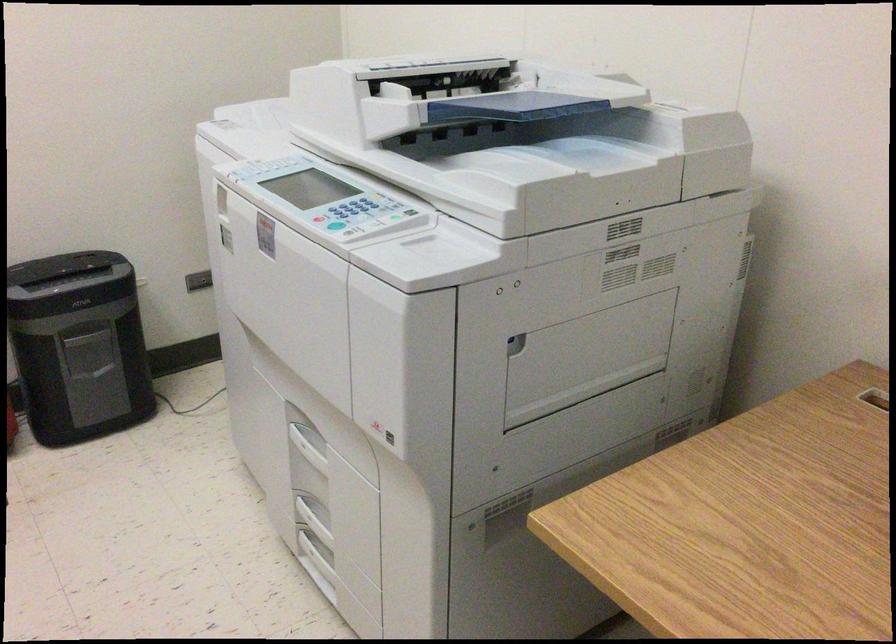
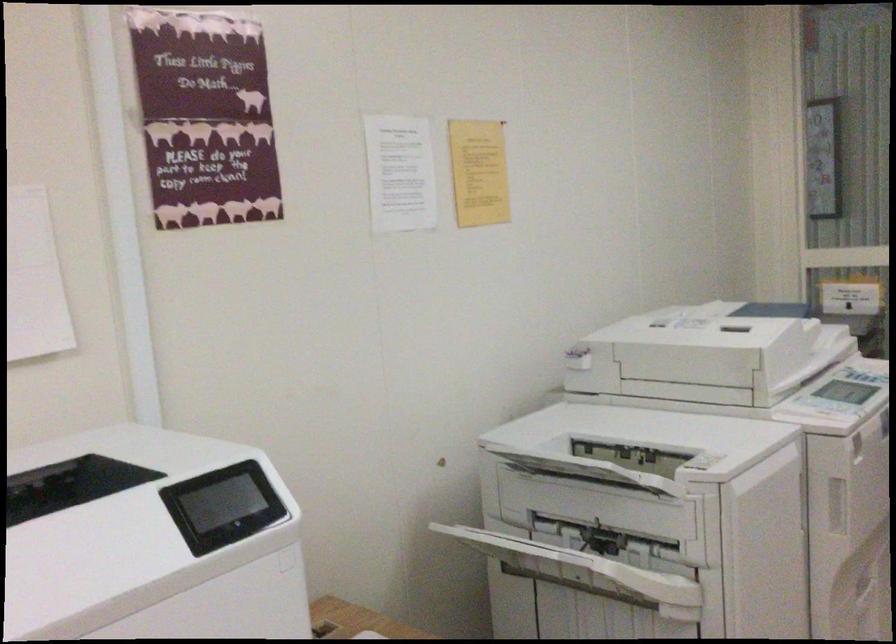
Question: The camera is either moving clockwise (left) or counter-clockwise (right) around the object. The first image is from the beginning of the video and the second image is from the end. Is the camera moving left or right when shooting the video?

Choices:
 (A) Left
 (B) Right

Answer: (A)